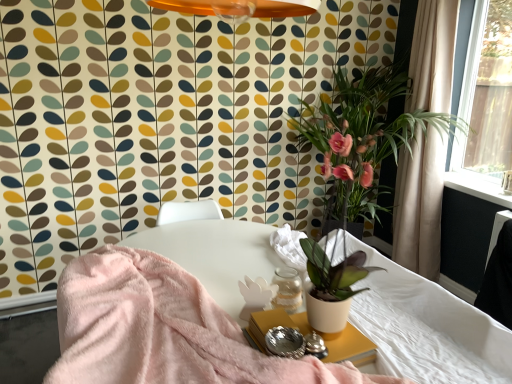
Question: Is white fabric mattress at lower right taller or shorter than white matte side table at lower center?

Choices:
 (A) short
 (B) tall

Answer: (B)

Question: Considering the positions of white fabric mattress at lower right and white matte side table at lower center in the image, is white fabric mattress at lower right bigger or smaller than white matte side table at lower center?

Choices:
 (A) big
 (B) small

Answer: (A)

Question: Estimate the real-world distances between objects in this image. Which object is closer to the white fabric mattress at lower right?

Choices:
 (A) beige fabric curtain at right
 (B) white matte side table at lower center
 (C) matte white pot at center

Answer: (B)

Question: Which object is the closest to the white matte side table at lower center?

Choices:
 (A) matte white pot at center
 (B) white fabric mattress at lower right
 (C) beige fabric curtain at right

Answer: (B)